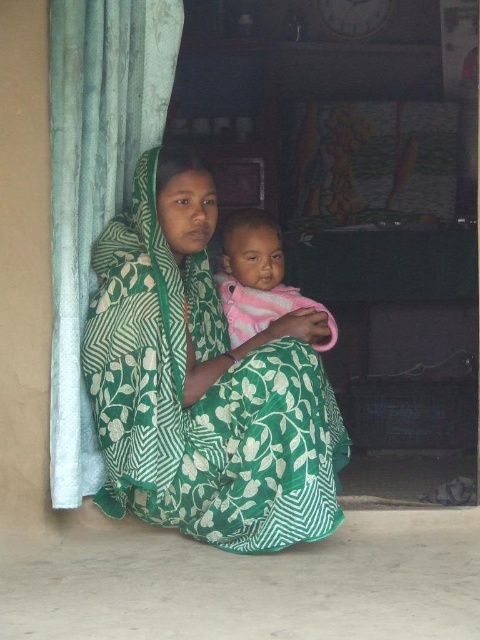
Question: Does green printed fabric at center appear under pink soft fabric baby at center?

Choices:
 (A) no
 (B) yes

Answer: (B)

Question: Which of the following is the closest to the observer?

Choices:
 (A) green printed fabric at center
 (B) pink soft fabric baby at center

Answer: (A)

Question: Is green printed fabric at center wider than pink soft fabric baby at center?

Choices:
 (A) no
 (B) yes

Answer: (B)

Question: Can you confirm if green printed fabric at center is bigger than pink soft fabric baby at center?

Choices:
 (A) yes
 (B) no

Answer: (A)

Question: Among these objects, which one is nearest to the camera?

Choices:
 (A) green printed fabric at center
 (B) pink soft fabric baby at center

Answer: (A)